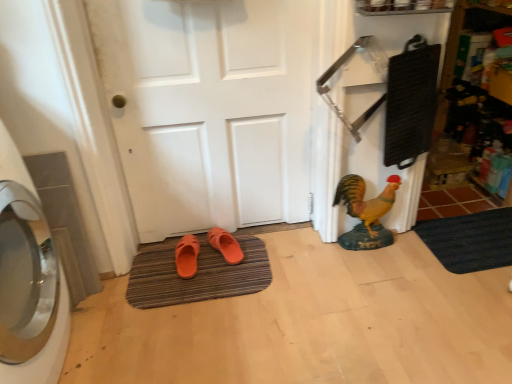
Question: Can you confirm if orange matte slippers at center, the 1th footwear viewed from the right, is smaller than black rubber bath mat at lower right, marked as the second bath mat in a left-to-right arrangement?

Choices:
 (A) no
 (B) yes

Answer: (B)

Question: Does orange matte slippers at center, arranged as the 2th footwear when viewed from the left, appear on the right side of black rubber bath mat at lower right, which is counted as the 1th bath mat, starting from the right?

Choices:
 (A) no
 (B) yes

Answer: (A)

Question: Is orange matte slippers at center, arranged as the 2th footwear when viewed from the left, completely or partially outside of black rubber bath mat at lower right, which is counted as the 1th bath mat, starting from the right?

Choices:
 (A) yes
 (B) no

Answer: (A)

Question: Is orange matte slippers at center, arranged as the 2th footwear when viewed from the left, closer to camera compared to black rubber bath mat at lower right, which is counted as the 1th bath mat, starting from the right?

Choices:
 (A) no
 (B) yes

Answer: (A)

Question: Considering the relative sizes of orange matte slippers at center, the 1th footwear viewed from the right, and black rubber bath mat at lower right, which is counted as the 1th bath mat, starting from the right, in the image provided, is orange matte slippers at center, the 1th footwear viewed from the right, thinner than black rubber bath mat at lower right, which is counted as the 1th bath mat, starting from the right,?

Choices:
 (A) no
 (B) yes

Answer: (B)

Question: From their relative heights in the image, would you say brown striped bath mat at center, the first bath mat viewed from the left, is taller or shorter than black rubber bath mat at lower right, marked as the second bath mat in a left-to-right arrangement?

Choices:
 (A) short
 (B) tall

Answer: (A)

Question: Considering the positions of brown striped bath mat at center, placed as the second bath mat when sorted from right to left, and black rubber bath mat at lower right, which is counted as the 1th bath mat, starting from the right, in the image, is brown striped bath mat at center, placed as the second bath mat when sorted from right to left, bigger or smaller than black rubber bath mat at lower right, which is counted as the 1th bath mat, starting from the right,?

Choices:
 (A) small
 (B) big

Answer: (B)

Question: Considering the relative positions of brown striped bath mat at center, placed as the second bath mat when sorted from right to left, and black rubber bath mat at lower right, which is counted as the 1th bath mat, starting from the right, in the image provided, is brown striped bath mat at center, placed as the second bath mat when sorted from right to left, to the left or to the right of black rubber bath mat at lower right, which is counted as the 1th bath mat, starting from the right,?

Choices:
 (A) right
 (B) left

Answer: (B)

Question: From the image's perspective, relative to black rubber bath mat at lower right, marked as the second bath mat in a left-to-right arrangement, is brown striped bath mat at center, placed as the second bath mat when sorted from right to left, above or below?

Choices:
 (A) below
 (B) above

Answer: (A)

Question: From a real-world perspective, is orange rubber slipper at lower center, positioned as the first footwear in left-to-right order, above or below black rubber bath mat at lower right, which is counted as the 1th bath mat, starting from the right?

Choices:
 (A) below
 (B) above

Answer: (B)

Question: From the image's perspective, is orange rubber slipper at lower center, positioned as the first footwear in left-to-right order, positioned above or below black rubber bath mat at lower right, marked as the second bath mat in a left-to-right arrangement?

Choices:
 (A) below
 (B) above

Answer: (A)

Question: Is orange rubber slipper at lower center, positioned as the first footwear in left-to-right order, inside or outside of black rubber bath mat at lower right, marked as the second bath mat in a left-to-right arrangement?

Choices:
 (A) inside
 (B) outside

Answer: (B)

Question: From their relative heights in the image, would you say orange rubber slipper at lower center, which is the second footwear from right to left, is taller or shorter than black rubber bath mat at lower right, marked as the second bath mat in a left-to-right arrangement?

Choices:
 (A) tall
 (B) short

Answer: (A)

Question: From the image's perspective, relative to white matte door at center, is brown striped bath mat at center, the first bath mat viewed from the left, above or below?

Choices:
 (A) above
 (B) below

Answer: (B)

Question: Is brown striped bath mat at center, the first bath mat viewed from the left, wider or thinner than white matte door at center?

Choices:
 (A) thin
 (B) wide

Answer: (B)